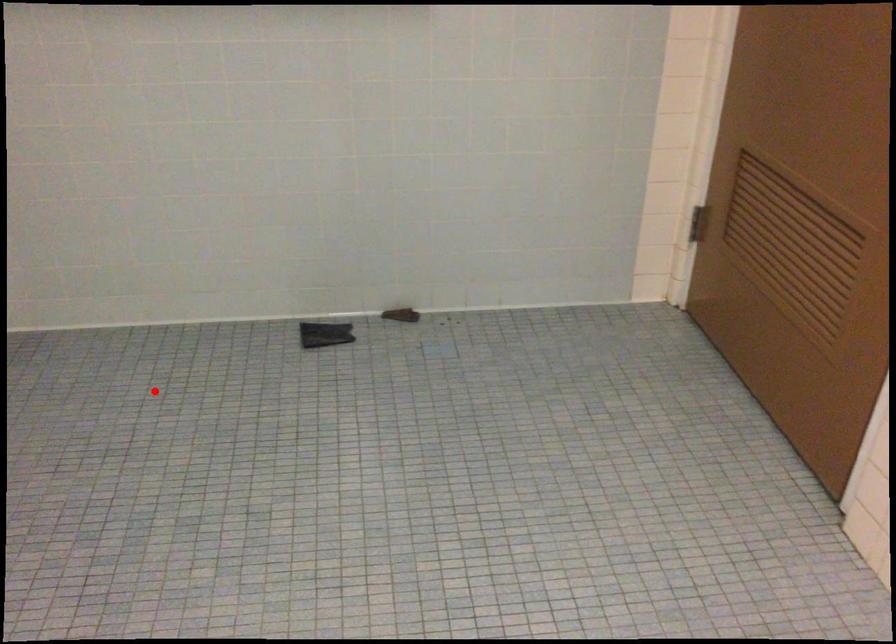
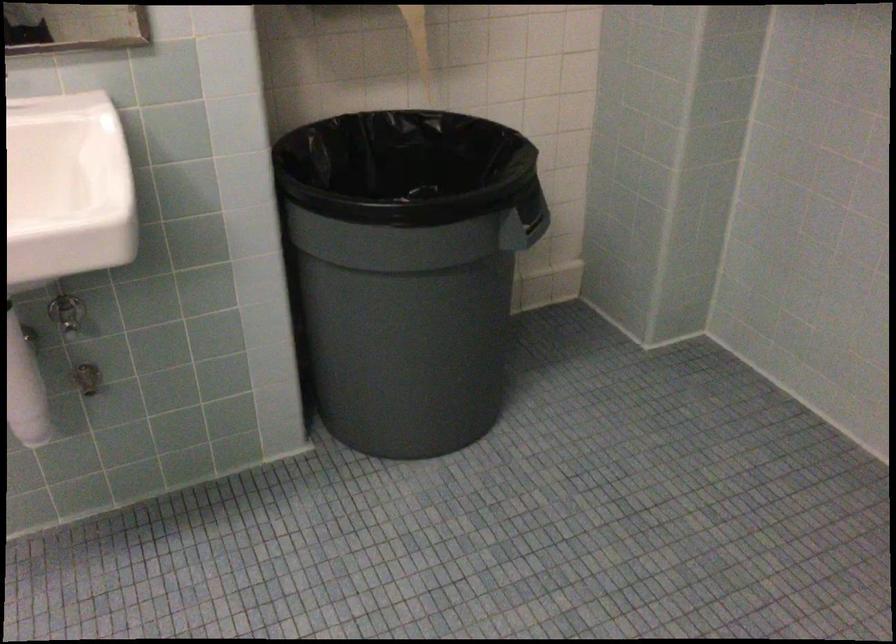
Question: I am providing you with two images of the same scene from different viewpoints. In image1, a red point is highlighted. Considering the same 3D point in image2, which of the following is correct?

Choices:
 (A) It is closer
 (B) It is farther

Answer: (A)